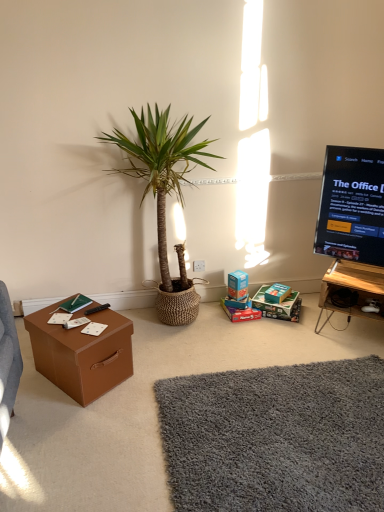
Find the location of `free space to the left of wooden entertainment center at right`. free space to the left of wooden entertainment center at right is located at coordinates (301, 335).